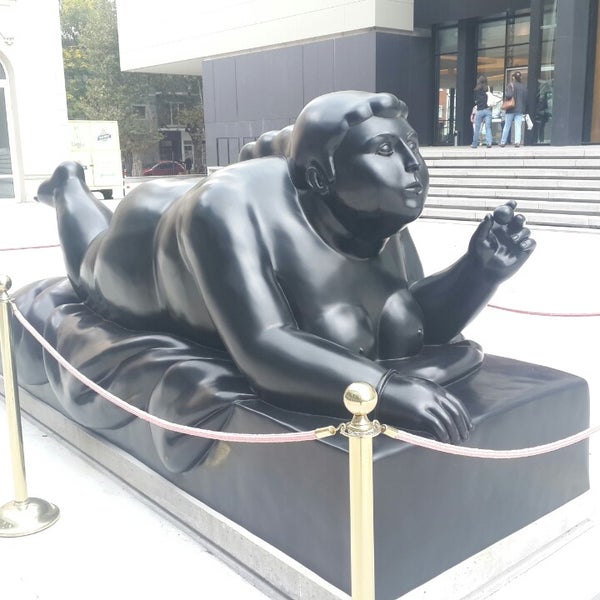
Find the location of a particular element. This screenshot has height=600, width=600. statue is located at coordinates (296, 323).